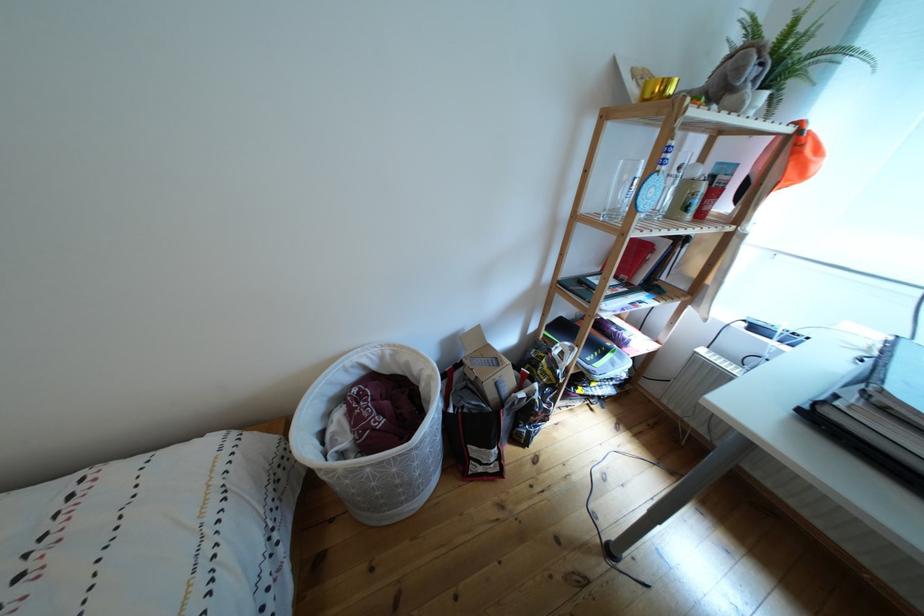
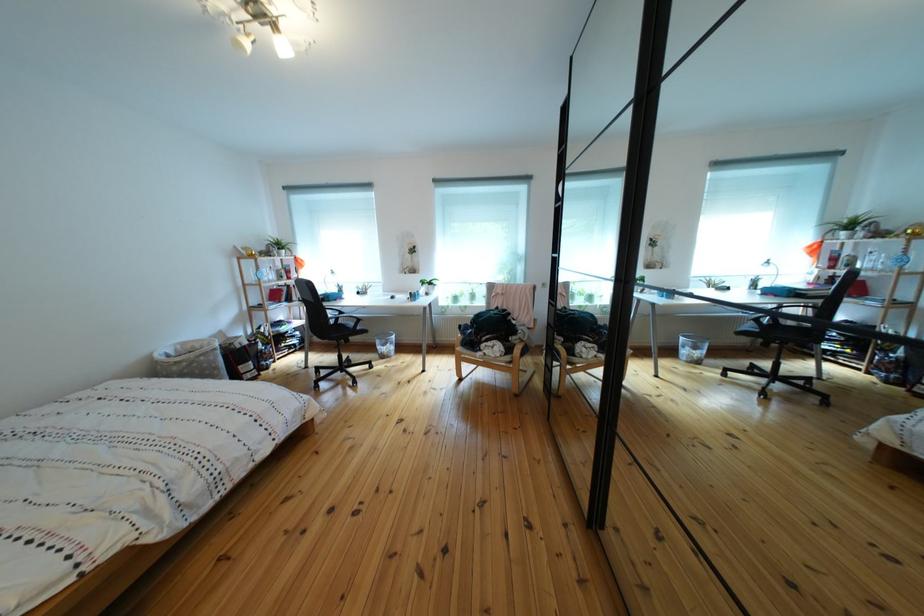
In the second image, find the point that corresponds to (x=393, y=363) in the first image.

(187, 355)